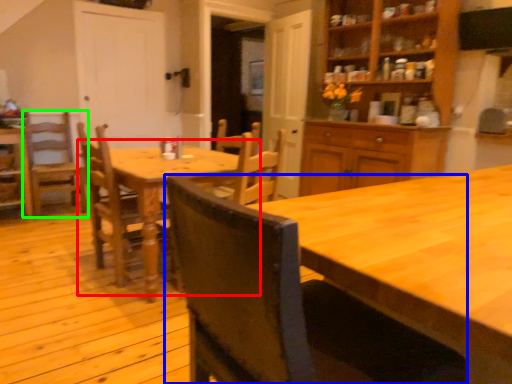
Question: Considering the real-world distances, which object is closest to kitchen & dining room table (highlighted by a red box)? chair (highlighted by a blue box) or chair (highlighted by a green box).

Choices:
 (A) chair
 (B) chair

Answer: (B)